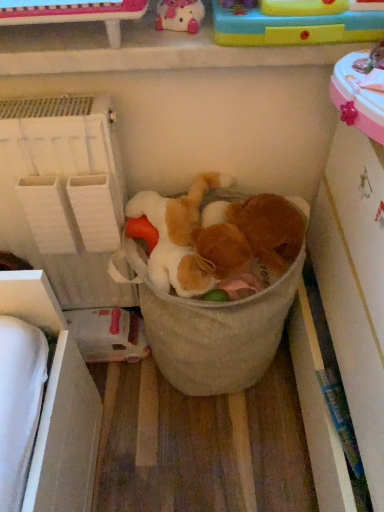
Question: Can matte pink plush at upper center, which ranks as the third toy in bottom-to-top order, be found inside beige fabric laundry basket at center?

Choices:
 (A) no
 (B) yes

Answer: (A)

Question: Can you confirm if beige fabric laundry basket at center is smaller than matte pink plush at upper center, which ranks as the third toy in bottom-to-top order?

Choices:
 (A) no
 (B) yes

Answer: (A)

Question: Can you confirm if beige fabric laundry basket at center is taller than matte pink plush at upper center, which ranks as the third toy in bottom-to-top order?

Choices:
 (A) yes
 (B) no

Answer: (A)

Question: Considering the relative sizes of beige fabric laundry basket at center and matte pink plush at upper center, which ranks as the third toy in bottom-to-top order, in the image provided, is beige fabric laundry basket at center thinner than matte pink plush at upper center, which ranks as the third toy in bottom-to-top order,?

Choices:
 (A) no
 (B) yes

Answer: (A)

Question: Is beige fabric laundry basket at center positioned before matte pink plush at upper center, which ranks as the third toy in bottom-to-top order?

Choices:
 (A) yes
 (B) no

Answer: (B)

Question: From a real-world perspective, is rubberized plastic toy at upper right, which is the 2th toy from top to bottom, positioned above or below matte pink plush at upper center, which ranks as the third toy in bottom-to-top order?

Choices:
 (A) above
 (B) below

Answer: (B)

Question: Looking at their shapes, would you say rubberized plastic toy at upper right, which ranks as the second toy in bottom-to-top order, is wider or thinner than matte pink plush at upper center, which ranks as the third toy in bottom-to-top order?

Choices:
 (A) wide
 (B) thin

Answer: (A)

Question: Looking at the image, does rubberized plastic toy at upper right, which is the 2th toy from top to bottom, seem bigger or smaller compared to matte pink plush at upper center, which ranks as the third toy in bottom-to-top order?

Choices:
 (A) small
 (B) big

Answer: (B)

Question: Is rubberized plastic toy at upper right, which ranks as the second toy in bottom-to-top order, taller or shorter than matte pink plush at upper center, which ranks as the third toy in bottom-to-top order?

Choices:
 (A) short
 (B) tall

Answer: (A)

Question: Is white fabric shelf at left wider or thinner than fluffy white teddy bear at center, the 1th toy ordered from the bottom?

Choices:
 (A) thin
 (B) wide

Answer: (A)

Question: From the image's perspective, relative to fluffy white teddy bear at center, the 1th toy ordered from the bottom, is white fabric shelf at left above or below?

Choices:
 (A) below
 (B) above

Answer: (B)

Question: Considering the positions of point (94, 106) and point (180, 228), is point (94, 106) closer or farther from the camera than point (180, 228)?

Choices:
 (A) closer
 (B) farther

Answer: (A)

Question: Relative to fluffy white teddy bear at center, the 1th toy ordered from the bottom, is white fabric shelf at left in front or behind?

Choices:
 (A) behind
 (B) front

Answer: (B)

Question: From the image's perspective, is rubberized plastic toy at upper right, which ranks as the second toy in bottom-to-top order, above or below beige fabric laundry basket at center?

Choices:
 (A) below
 (B) above

Answer: (B)

Question: Is rubberized plastic toy at upper right, which ranks as the second toy in bottom-to-top order, spatially inside beige fabric laundry basket at center, or outside of it?

Choices:
 (A) inside
 (B) outside

Answer: (B)